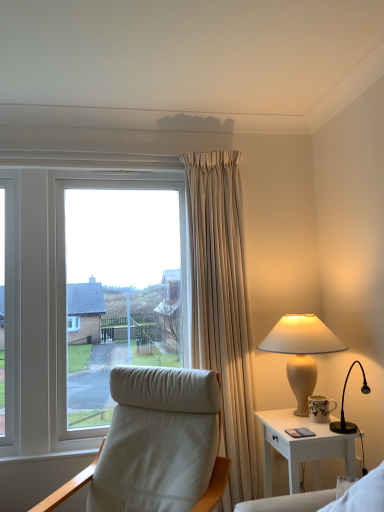
Question: Does matte beige lamp at right contain white glossy nightstand at right?

Choices:
 (A) no
 (B) yes

Answer: (A)

Question: Considering the relative positions of matte beige lamp at right and white glossy nightstand at right in the image provided, is matte beige lamp at right to the left of white glossy nightstand at right from the viewer's perspective?

Choices:
 (A) no
 (B) yes

Answer: (A)

Question: Is matte beige lamp at right positioned with its back to white glossy nightstand at right?

Choices:
 (A) yes
 (B) no

Answer: (B)

Question: Is matte beige lamp at right further to the viewer compared to white glossy nightstand at right?

Choices:
 (A) no
 (B) yes

Answer: (B)

Question: Are matte beige lamp at right and white glossy nightstand at right beside each other?

Choices:
 (A) yes
 (B) no

Answer: (B)

Question: Is point (314, 361) positioned closer to the camera than point (266, 437)?

Choices:
 (A) farther
 (B) closer

Answer: (A)

Question: From a real-world perspective, is matte beige lamp at right physically located above or below white glossy nightstand at right?

Choices:
 (A) below
 (B) above

Answer: (B)

Question: Choose the correct answer: Is matte beige lamp at right inside white glossy nightstand at right or outside it?

Choices:
 (A) outside
 (B) inside

Answer: (A)

Question: In terms of width, does matte beige lamp at right look wider or thinner when compared to white glossy nightstand at right?

Choices:
 (A) wide
 (B) thin

Answer: (A)

Question: Considering their positions, is white leather chair at left located in front of or behind matte beige lamp at right?

Choices:
 (A) behind
 (B) front

Answer: (B)

Question: Would you say white leather chair at left is to the left or to the right of matte beige lamp at right in the picture?

Choices:
 (A) right
 (B) left

Answer: (B)

Question: In terms of size, does white leather chair at left appear bigger or smaller than matte beige lamp at right?

Choices:
 (A) small
 (B) big

Answer: (B)

Question: Choose the correct answer: Is white leather chair at left inside matte beige lamp at right or outside it?

Choices:
 (A) outside
 (B) inside

Answer: (A)

Question: In the image, is matte beige lamp at right on the left side or the right side of white leather chair at left?

Choices:
 (A) right
 (B) left

Answer: (A)

Question: Is matte beige lamp at right taller or shorter than white leather chair at left?

Choices:
 (A) tall
 (B) short

Answer: (B)